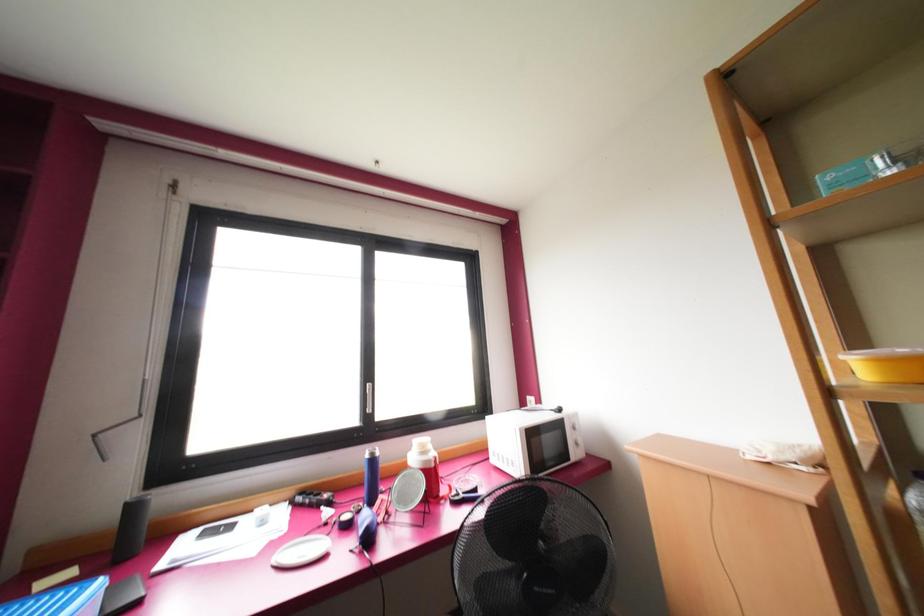
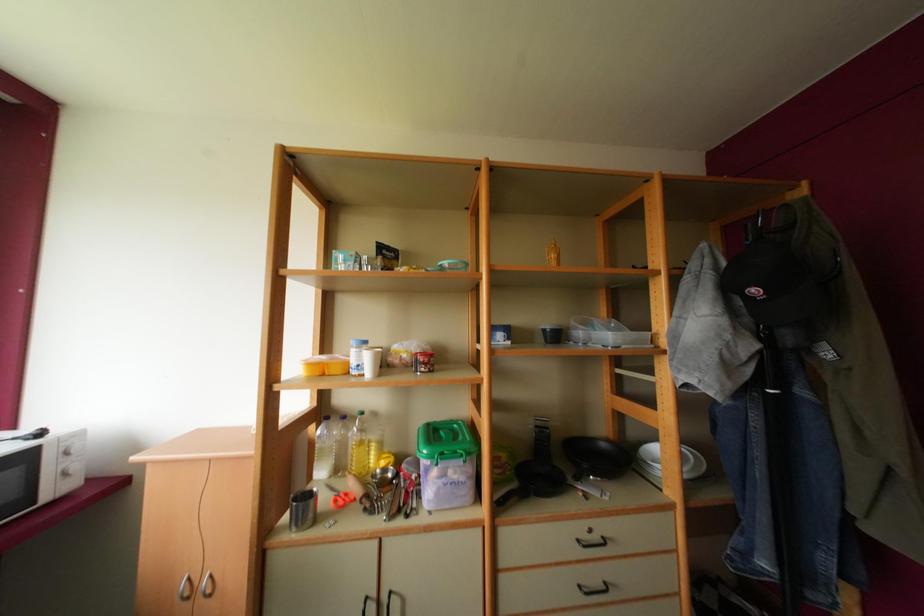
Question: The camera is either moving clockwise (left) or counter-clockwise (right) around the object. The first image is from the beginning of the video and the second image is from the end. Is the camera moving left or right when shooting the video?

Choices:
 (A) Left
 (B) Right

Answer: (A)